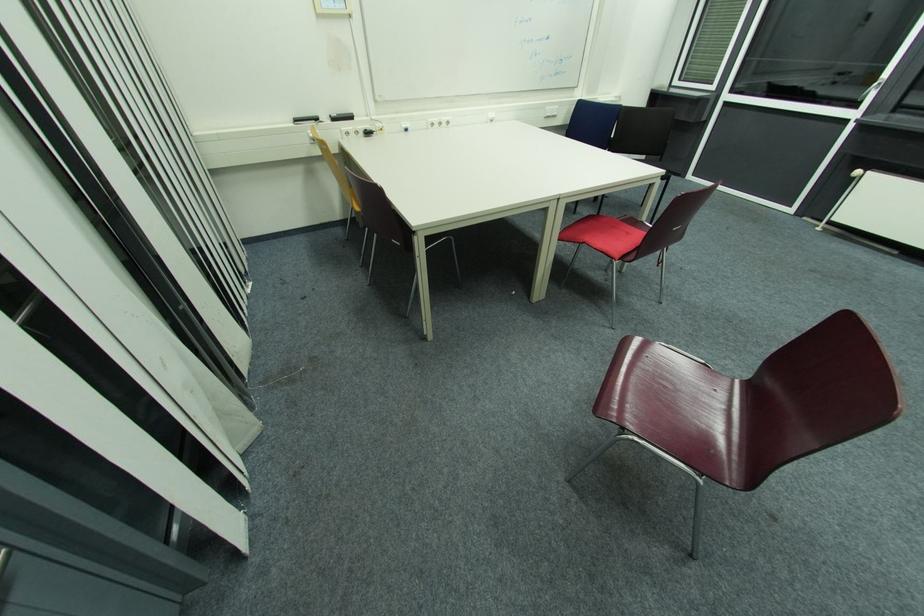
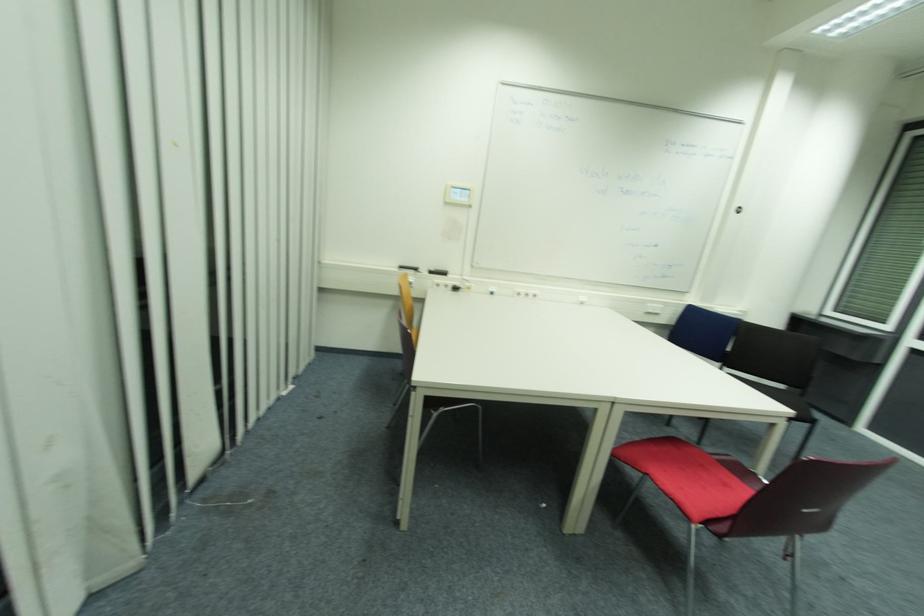
In the second image, find the point that corresponds to [320,120] in the first image.

(419, 270)